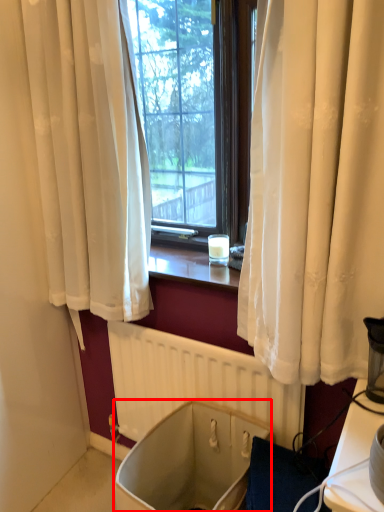
Question: From the image, what is the correct spatial relationship of bath (annotated by the red box) in relation to radiator?

Choices:
 (A) left
 (B) right

Answer: (A)